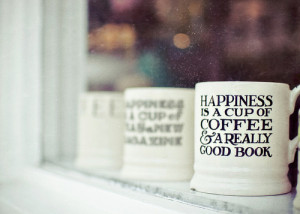
At what (x,y) coordinates should I click in order to perform the action: click on glass window pane. Please return your answer as a coordinate pair (x, y). Looking at the image, I should click on (159, 32).